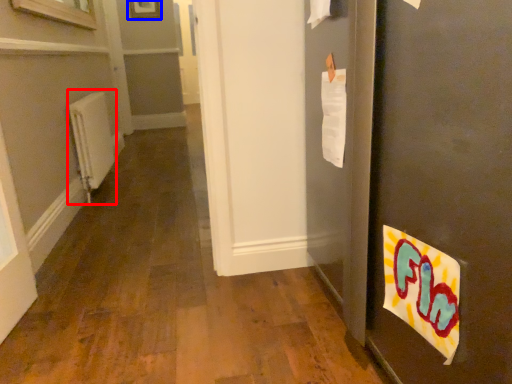
Question: Which of the following is the farthest to the observer, radiator (highlighted by a red box) or picture frame (highlighted by a blue box)?

Choices:
 (A) radiator
 (B) picture frame

Answer: (B)